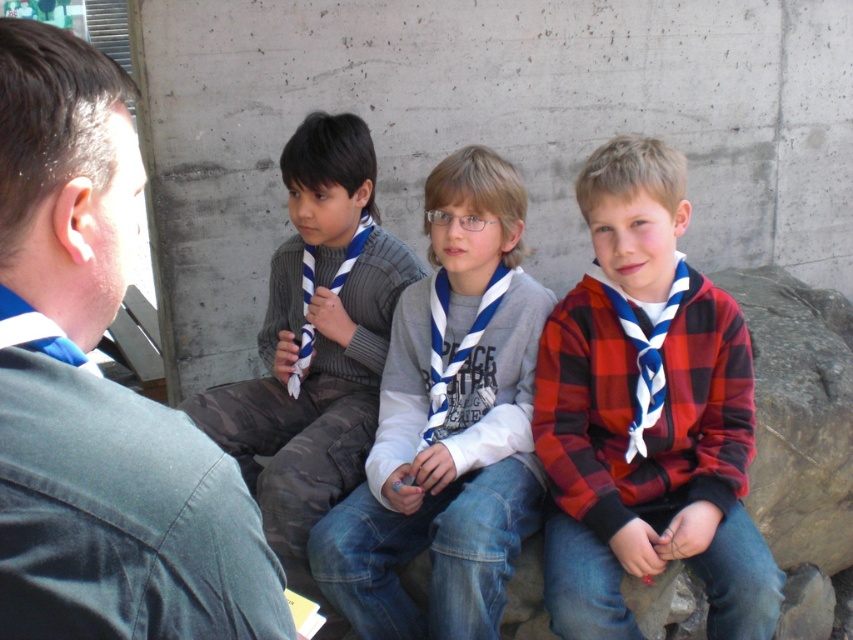
You are standing in front of the image of four boys sitting against a concrete wall. You need to place a small sticker exactly at the point marked as point (654, 371). If you step back 1 meter from your current position, will the sticker still be visible at that point?

The point (654, 371) is 2.33 meters away from the viewer. If you step back 1 meter, you will be 3.33 meters away. Since the sticker is placed at the point, it will still be visible as distance does not affect visibility of a specific point unless it goes out of frame, which isn not mentioned here.

You are standing at the point marked by coordinates (x=99, y=390) in the image. Looking towards the direction of the concrete wall, which object is directly in front of you?

The point at coordinates (x=99, y=390) corresponds to the dark gray shirt at left, so the dark gray shirt at left is directly in front of you.

Based on the scene description, which object is positioned to the left of the other? The dark gray shirt at left or the white cotton scarf at center?

The dark gray shirt at left is positioned to the left of the white cotton scarf at center.